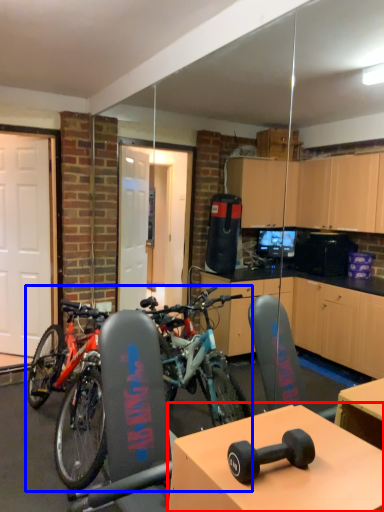
Question: Which point is closer to the camera, table (highlighted by a red box) or bicycle (highlighted by a blue box)?

Choices:
 (A) table
 (B) bicycle

Answer: (A)